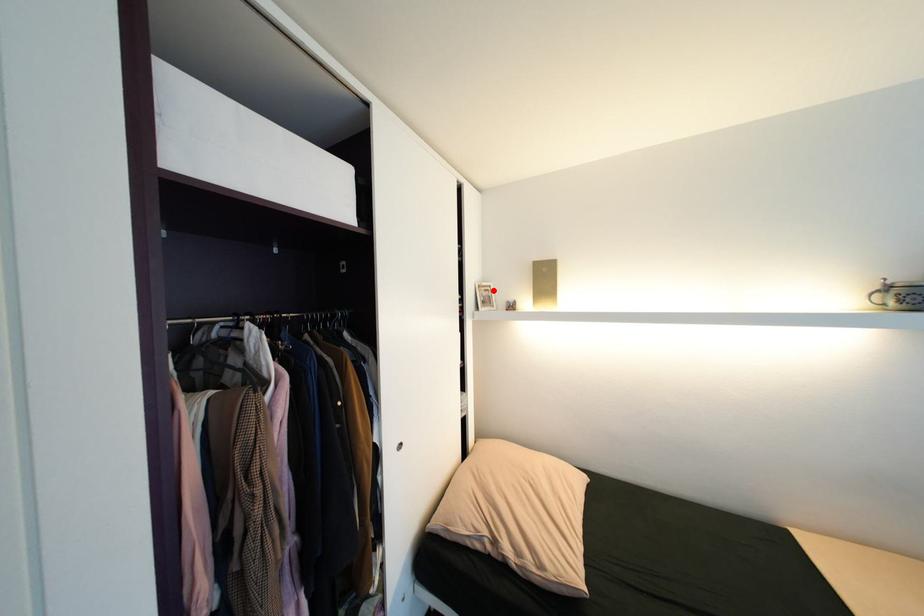
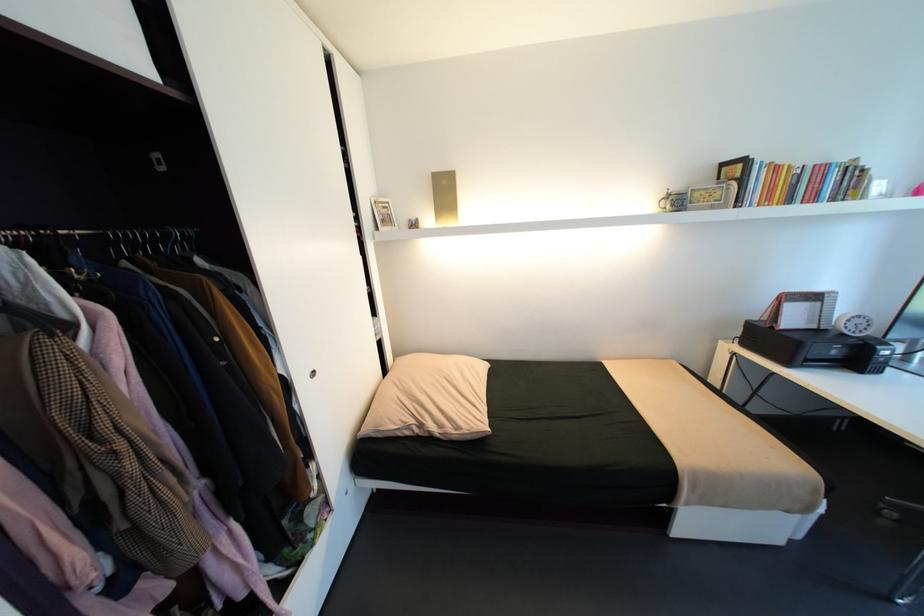
Question: I am providing you with two images of the same scene from different viewpoints. A red point is marked on the first image. Can you still see the location of the red point in image 2?

Choices:
 (A) Yes
 (B) No

Answer: (A)